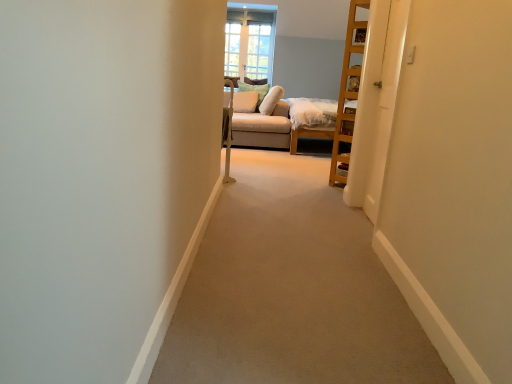
Question: Does white glossy door at right come in front of white fabric pillow at center, the first pillow positioned from the left?

Choices:
 (A) yes
 (B) no

Answer: (A)

Question: Is white glossy door at right oriented away from white fabric pillow at center, the first pillow positioned from the left?

Choices:
 (A) yes
 (B) no

Answer: (B)

Question: Is white glossy door at right to the left of white fabric pillow at center, which is the third pillow from right to left, from the viewer's perspective?

Choices:
 (A) no
 (B) yes

Answer: (A)

Question: Does white glossy door at right have a lesser width compared to white fabric pillow at center, which is the third pillow from right to left?

Choices:
 (A) no
 (B) yes

Answer: (B)

Question: Is white glossy door at right shorter than white fabric pillow at center, the first pillow positioned from the left?

Choices:
 (A) yes
 (B) no

Answer: (B)

Question: Considering the relative sizes of white glossy door at right and white fabric pillow at center, which is the third pillow from right to left, in the image provided, is white glossy door at right taller than white fabric pillow at center, which is the third pillow from right to left,?

Choices:
 (A) yes
 (B) no

Answer: (A)

Question: Is soft white pillow at center, the 3th pillow when ordered from left to right, far away from clear glass window at upper center?

Choices:
 (A) yes
 (B) no

Answer: (A)

Question: Could clear glass window at upper center be considered to be inside soft white pillow at center, the 3th pillow when ordered from left to right?

Choices:
 (A) yes
 (B) no

Answer: (B)

Question: From a real-world perspective, is soft white pillow at center, which is the 1th pillow in right-to-left order, located beneath clear glass window at upper center?

Choices:
 (A) no
 (B) yes

Answer: (B)

Question: Does soft white pillow at center, the 3th pillow when ordered from left to right, have a greater width compared to clear glass window at upper center?

Choices:
 (A) yes
 (B) no

Answer: (A)

Question: Considering the relative sizes of soft white pillow at center, which is the 1th pillow in right-to-left order, and clear glass window at upper center in the image provided, is soft white pillow at center, which is the 1th pillow in right-to-left order, smaller than clear glass window at upper center?

Choices:
 (A) no
 (B) yes

Answer: (A)

Question: Is soft white pillow at center, which is the 1th pillow in right-to-left order, positioned before clear glass window at upper center?

Choices:
 (A) no
 (B) yes

Answer: (B)

Question: Is white soft pillow at upper center, the second pillow positioned from the right, at the left side of clear glass window at upper center?

Choices:
 (A) yes
 (B) no

Answer: (B)